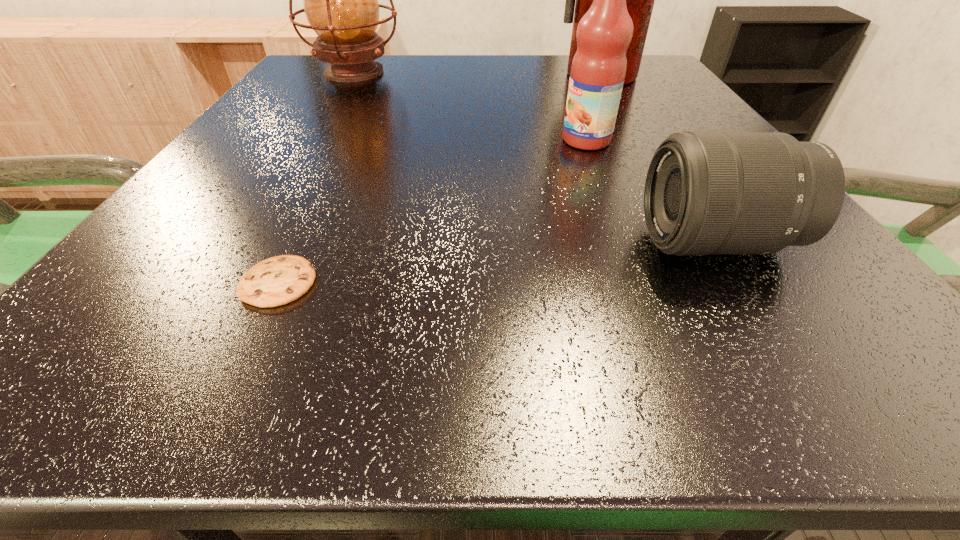
The image size is (960, 540). I want to click on free space located on the front label of the fruit juice, so click(x=514, y=140).

The height and width of the screenshot is (540, 960). What are the coordinates of `vacant position located on the surface of the second shortest object` in the screenshot? It's located at (515, 242).

Locate an element on the screen. This screenshot has height=540, width=960. vacant area located on the surface of the second shortest object is located at coordinates (572, 242).

Locate an element on the screen. The height and width of the screenshot is (540, 960). free spot located on the surface of the second shortest object is located at coordinates (572, 242).

You are a GUI agent. You are given a task and a screenshot of the screen. Output one action in this format:
    pyautogui.click(x=<x>, y=<y>)
    Task: Click on the vacant space located on the front of the cookie
    This screenshot has width=960, height=540.
    Given the screenshot: What is the action you would take?
    pyautogui.click(x=239, y=365)

Locate an element on the screen. The image size is (960, 540). fire extinguisher that is at the far edge is located at coordinates (640, 0).

This screenshot has height=540, width=960. What are the coordinates of `oil lamp positioned at the far edge` in the screenshot? It's located at (340, 0).

Where is `oil lamp situated at the left edge`? The image size is (960, 540). oil lamp situated at the left edge is located at coordinates (340, 0).

Where is `cookie located at the left edge`? This screenshot has height=540, width=960. cookie located at the left edge is located at coordinates (279, 280).

At what (x,y) coordinates should I click in order to perform the action: click on fire extinguisher at the right edge. Please return your answer as a coordinate pair (x, y). The height and width of the screenshot is (540, 960). Looking at the image, I should click on (640, 0).